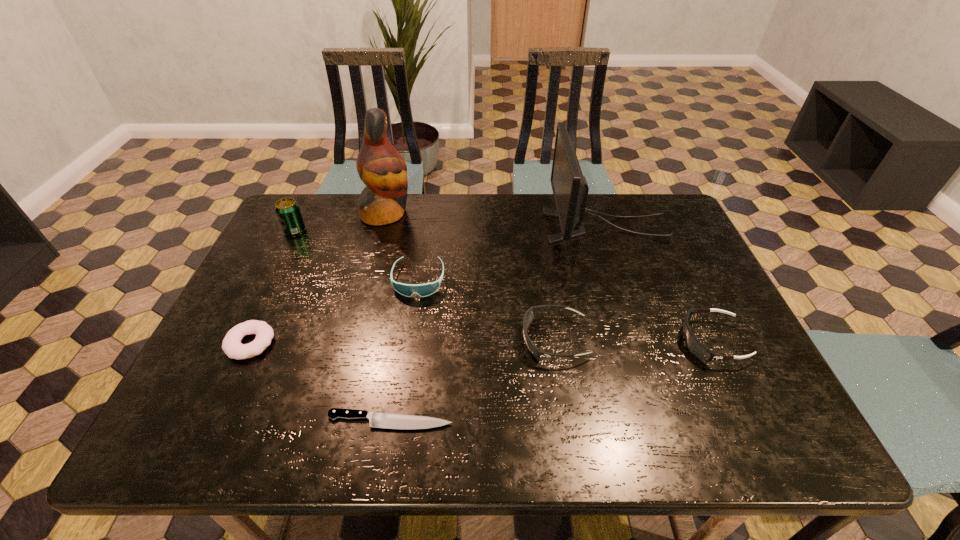
Identify the location of free point located on the face of the tallest object. The height and width of the screenshot is (540, 960). (458, 213).

The image size is (960, 540). I want to click on free point located on the screen side of the computer monitor, so [418, 226].

This screenshot has width=960, height=540. I want to click on blank space located on the screen side of the computer monitor, so click(x=427, y=226).

This screenshot has height=540, width=960. What are the coordinates of `free region located on the screen side of the computer monitor` in the screenshot? It's located at (418, 226).

At what (x,y) coordinates should I click in order to perform the action: click on free space located on the front of the sixth shortest object. Please return your answer as a coordinate pair (x, y). Image resolution: width=960 pixels, height=540 pixels. Looking at the image, I should click on (244, 336).

Find the location of a particular element. The width and height of the screenshot is (960, 540). blank space located on the lenses of the second goggles from right to left is located at coordinates (379, 339).

This screenshot has width=960, height=540. I want to click on vacant space located on the lenses of the second goggles from right to left, so click(x=454, y=339).

You are a GUI agent. You are given a task and a screenshot of the screen. Output one action in this format:
    pyautogui.click(x=<x>, y=<y>)
    Task: Click on the free region located 0.340m on the lenses of the second goggles from right to left
    
    Given the screenshot: What is the action you would take?
    pyautogui.click(x=379, y=339)

At what (x,y) coordinates should I click in order to perform the action: click on free point located 0.150m on the front and sides of the rightmost goggles. Please return your answer as a coordinate pair (x, y). This screenshot has width=960, height=540. Looking at the image, I should click on (617, 341).

The image size is (960, 540). I want to click on blank space located on the front and sides of the rightmost goggles, so click(530, 341).